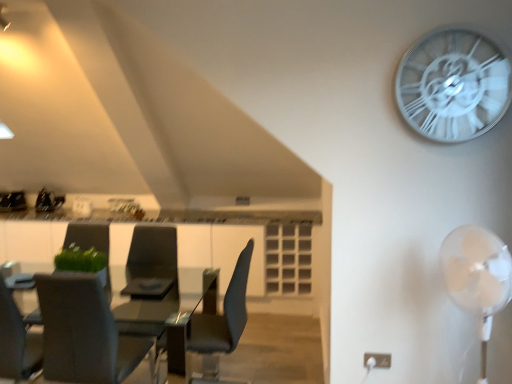
Question: Looking at their shapes, would you say white metallic clock at upper right is wider or thinner than matte black chair at center, arranged as the first chair when viewed from the right?

Choices:
 (A) thin
 (B) wide

Answer: (A)

Question: Relative to matte black chair at center, marked as the second chair in a left-to-right arrangement, is white metallic clock at upper right in front or behind?

Choices:
 (A) front
 (B) behind

Answer: (A)

Question: Considering the real-world distances, which object is farthest from the matte gray chair at left, the 2th chair in the right-to-left sequence?

Choices:
 (A) green fabric armchair at left, which appears as the 2th armchair when viewed from the right
 (B) matte black chair at center, marked as the second chair in a left-to-right arrangement
 (C) white plastic fan at right
 (D) matte black armchair at center, positioned as the first armchair in right-to-left order
 (E) white metallic clock at upper right

Answer: (E)

Question: Estimate the real-world distances between objects in this image. Which object is farther from the white metallic clock at upper right?

Choices:
 (A) matte black armchair at center, positioned as the first armchair in right-to-left order
 (B) matte black chair at center, marked as the second chair in a left-to-right arrangement
 (C) green fabric armchair at left, which appears as the 2th armchair when viewed from the right
 (D) white plastic fan at right
 (E) matte gray chair at left, the 2th chair in the right-to-left sequence

Answer: (C)